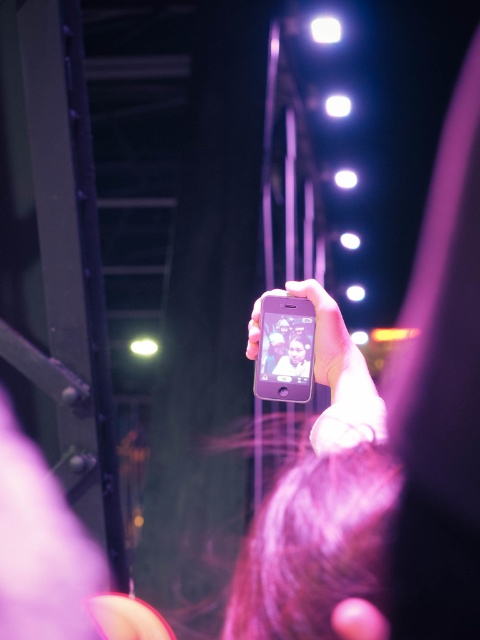
Question: Which point is farther from the camera taking this photo?

Choices:
 (A) (324, 346)
 (B) (294, 310)
 (C) (259, 339)

Answer: (B)

Question: Which of the following is the closest to the observer?

Choices:
 (A) matte black smartphone at center
 (B) matte silver phone at center

Answer: (A)

Question: Is matte black smartphone at center below matte purple phone at center?

Choices:
 (A) yes
 (B) no

Answer: (A)

Question: Which object is closer to the camera taking this photo?

Choices:
 (A) matte purple phone at center
 (B) matte black smartphone at center

Answer: (A)

Question: Does matte purple phone at center appear under matte silver phone at center?

Choices:
 (A) no
 (B) yes

Answer: (B)

Question: Is the position of matte black smartphone at center less distant than that of matte silver phone at center?

Choices:
 (A) yes
 (B) no

Answer: (A)